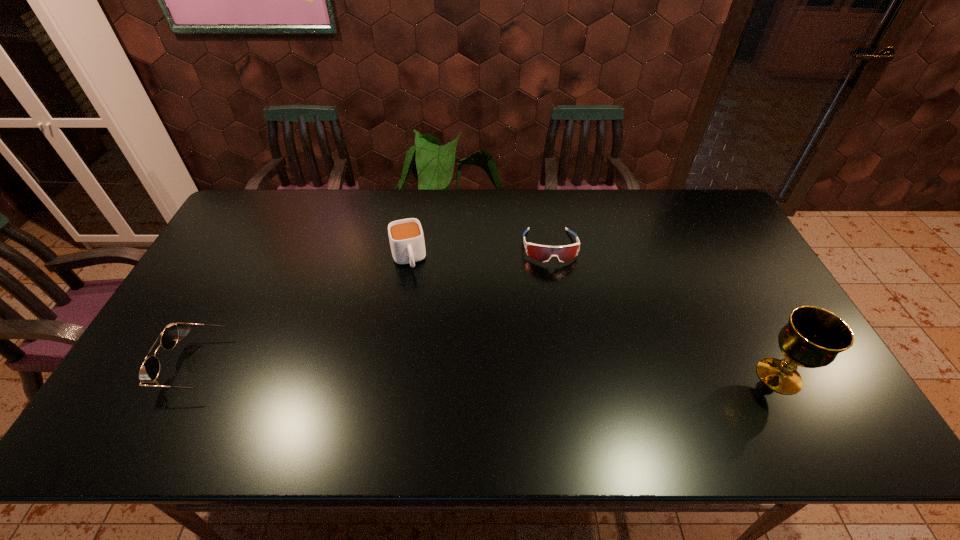
Where is `unoccupied position between the second object from right to left and the leftmost object`? unoccupied position between the second object from right to left and the leftmost object is located at coordinates (376, 307).

You are a GUI agent. You are given a task and a screenshot of the screen. Output one action in this format:
    pyautogui.click(x=<x>, y=<y>)
    Task: Click on the free area in between the rightmost object and the third object from left to right
    
    Given the screenshot: What is the action you would take?
    pyautogui.click(x=664, y=312)

Locate an element on the screen. free spot between the leftmost object and the tallest object is located at coordinates (491, 371).

Image resolution: width=960 pixels, height=540 pixels. Identify the location of vacant space that is in between the sunglasses and the chalice. (491, 371).

At what (x,y) coordinates should I click in order to perform the action: click on free space between the rightmost object and the shortest object. Please return your answer as a coordinate pair (x, y). The height and width of the screenshot is (540, 960). Looking at the image, I should click on (664, 312).

The height and width of the screenshot is (540, 960). In order to click on vacant space that's between the third object from left to right and the leftmost object in this screenshot , I will do `click(376, 307)`.

Select which object is the closest to the tallest object. Please provide its 2D coordinates. Your answer should be formatted as a tuple, i.e. [(x, y)], where the tuple contains the x and y coordinates of a point satisfying the conditions above.

[(542, 253)]

Identify the location of the third closest object to the leftmost object. This screenshot has height=540, width=960. (813, 337).

What are the coordinates of `vacant position in the image that satisfies the following two spatial constraints: 1. on the back side of the third object from right to left; 2. on the right side of the goggles` in the screenshot? It's located at (410, 247).

The width and height of the screenshot is (960, 540). I want to click on vacant point that satisfies the following two spatial constraints: 1. on the front side of the rightmost object; 2. on the right side of the second object from right to left, so 571,376.